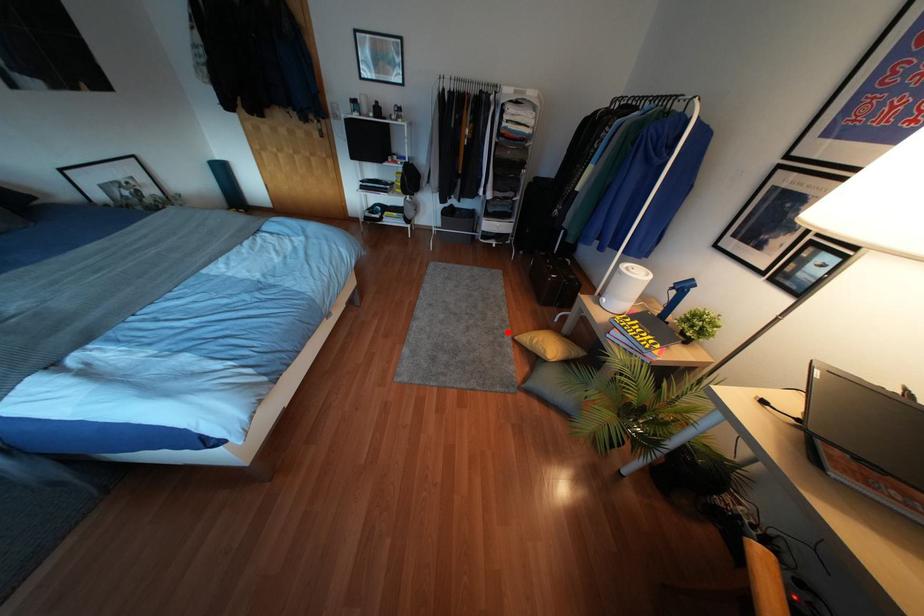
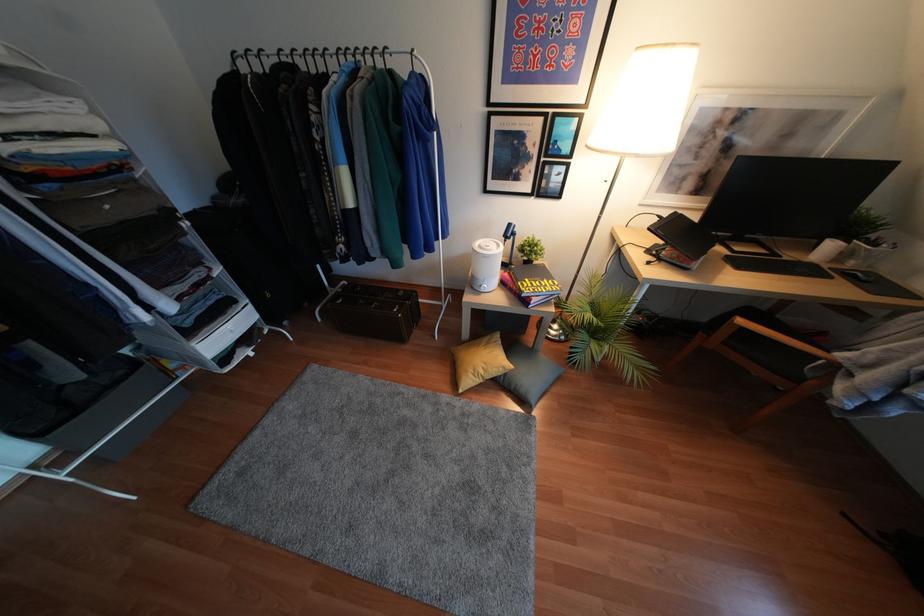
In the second image, find the point that corresponds to the highlighted location in the first image.

(445, 397)